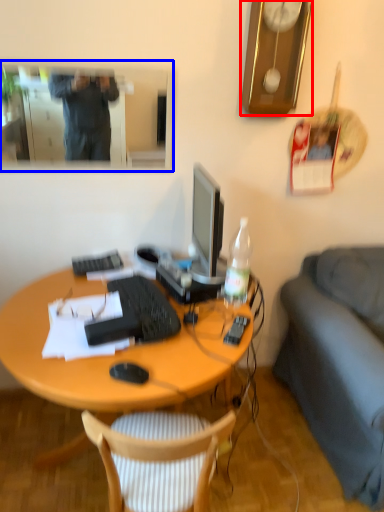
Question: Among these objects, which one is nearest to the camera, clock (highlighted by a red box) or mirror (highlighted by a blue box)?

Choices:
 (A) clock
 (B) mirror

Answer: (A)